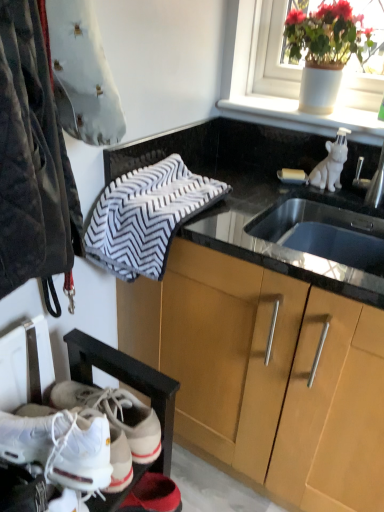
Find the location of a particular element. The width and height of the screenshot is (384, 512). vacant space in white ceramic pot at upper right (from a real-world perspective) is located at coordinates (324, 113).